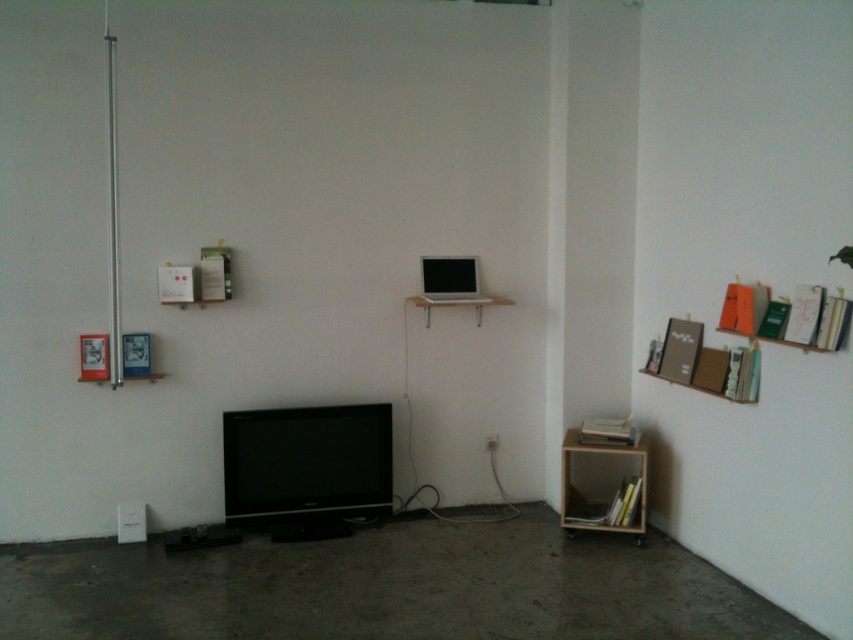
Is point (378, 486) positioned in front of point (585, 449)?

No, (378, 486) is behind (585, 449).

Does black glossy flat screen tv at center come behind wooden bookshelf at lower right?

That is True.

Which is in front, point (248, 410) or point (630, 461)?

Point (248, 410)

At what (x,y) coordinates should I click in order to perform the action: click on black glossy flat screen tv at center. Please return your answer as a coordinate pair (x, y). The image size is (853, 640). Looking at the image, I should click on (306, 468).